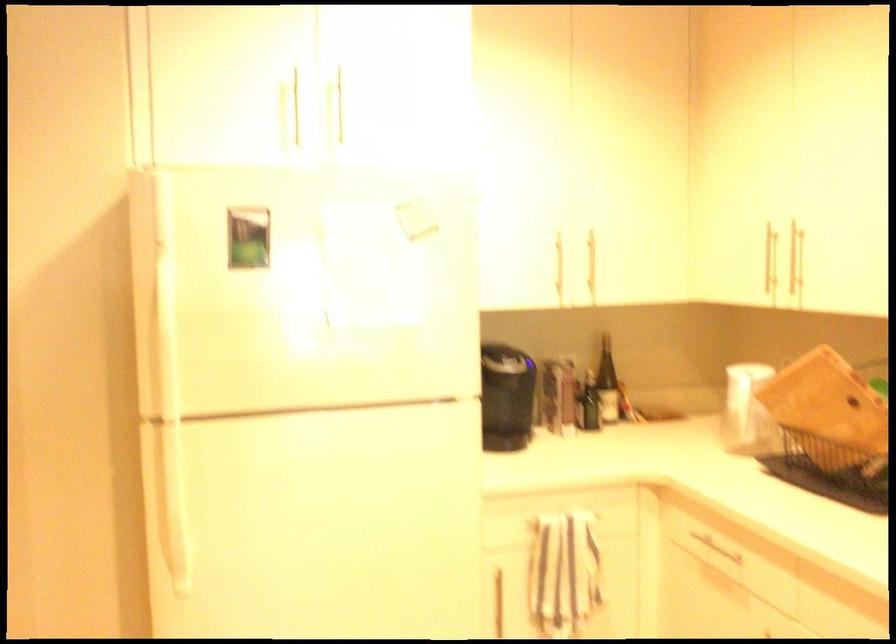
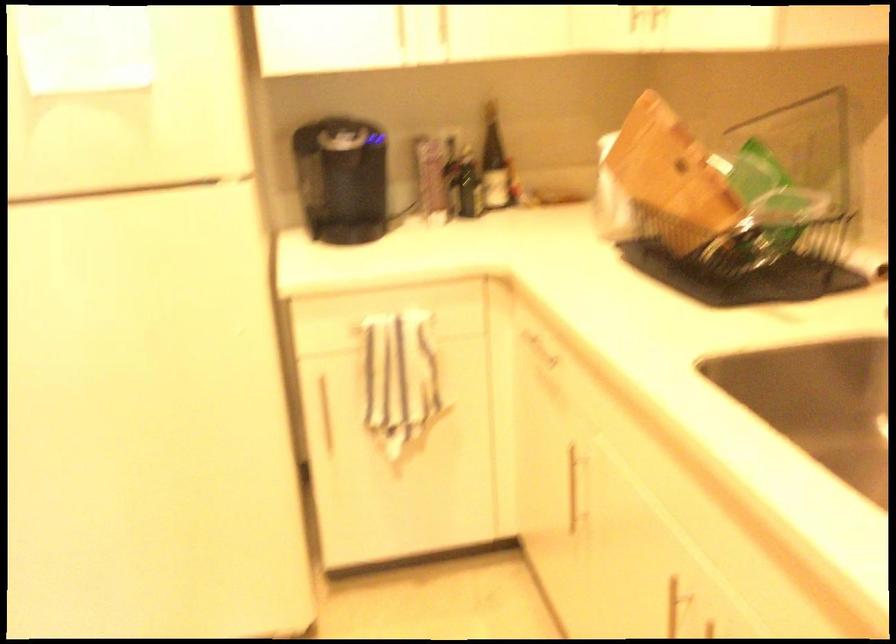
In the second image, find the point that corresponds to point 600,379 in the first image.

(494, 163)